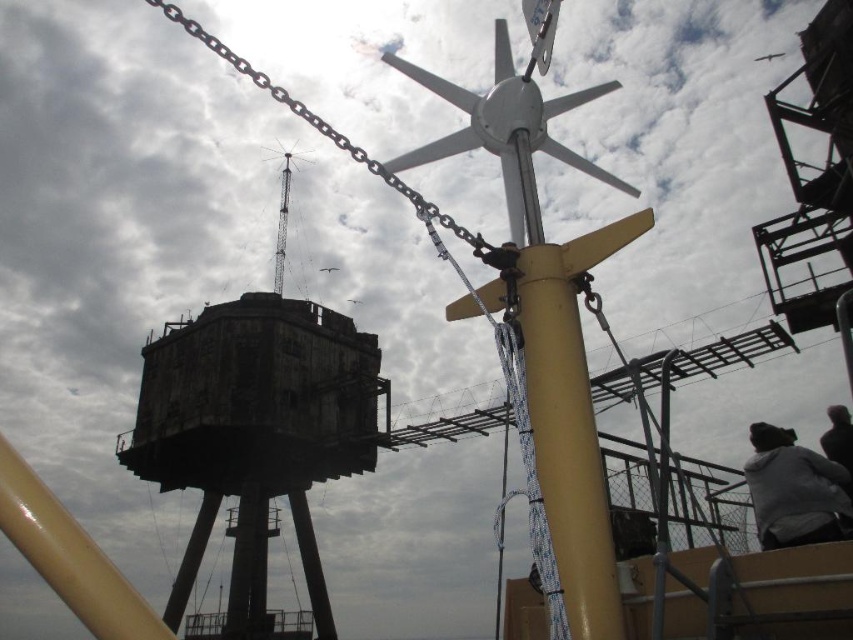
You are standing at the origin point of the scene. You need to locate the gray fleece jacket at lower right. Which direction should you move to reach it?

The gray fleece jacket at lower right is located at coordinate point 0.767 on the x axis and 0.931 on the y axis. Since the origin is typically at the bottom left corner of an image, moving towards the right along the x axis and slightly upwards along the y axis would lead you to the jacket.

You are a drone operator tasked with flying a drone from the dark gray concrete tower at center to the dark gray hair at lower right. The drone has a maximum flight range of 80 meters. Will it be able to reach the destination without needing to recharge?

The dark gray concrete tower at center and dark gray hair at lower right are 86.81 meters apart. Since the drone can only fly 80 meters before needing to recharge, it will not be able to reach the destination without recharging.

You are a photographer trying to capture a clear shot of the dark gray hair at lower right and the dark gray concrete tower at center. Which object will appear closer to the camera in the photo?

The dark gray concrete tower at center will appear closer to the camera because the dark gray hair at lower right is behind it.